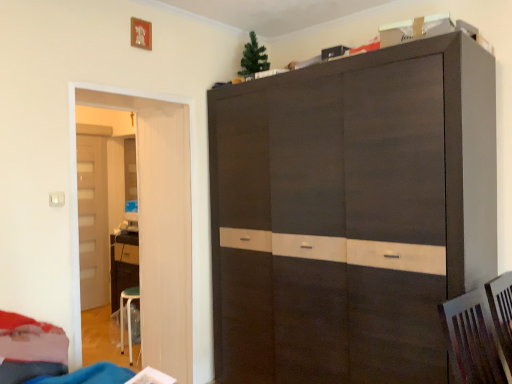
What is the approximate width of white glossy door at left, which appears as the first door when viewed from the front?

white glossy door at left, which appears as the first door when viewed from the front, is 2.17 inches wide.

What do you see at coordinates (153, 221) in the screenshot?
I see `white glossy door at left, which is the 2th door in left-to-right order` at bounding box center [153, 221].

What do you see at coordinates (93, 220) in the screenshot?
I see `light brown wood door at left, positioned as the first door in left-to-right order` at bounding box center [93, 220].

Describe the element at coordinates (30, 349) in the screenshot. I see `velvet red bed at lower left` at that location.

I want to click on white glossy door at left, positioned as the second door in back-to-front order, so pos(153,221).

How different are the orientations of velvet red bed at lower left and light brown wood door at left, the 2th door in the front-to-back sequence, in degrees?

They differ by 1.92 degrees in their facing directions.

Is velvet red bed at lower left not inside light brown wood door at left, positioned as the first door in left-to-right order?

Yes, velvet red bed at lower left is not within light brown wood door at left, positioned as the first door in left-to-right order.

Is velvet red bed at lower left next to light brown wood door at left, which is the second door from right to left, and touching it?

No, velvet red bed at lower left is not in contact with light brown wood door at left, which is the second door from right to left.

Is velvet red bed at lower left positioned with its back to light brown wood door at left, the 2th door in the front-to-back sequence?

velvet red bed at lower left does not have its back to light brown wood door at left, the 2th door in the front-to-back sequence.

Looking at their sizes, would you say velvet red bed at lower left is wider or thinner than white glossy door at left, which is the 2th door in left-to-right order?

Considering their sizes, velvet red bed at lower left looks broader than white glossy door at left, which is the 2th door in left-to-right order.

Would you say velvet red bed at lower left is to the left or to the right of white glossy door at left, the first door in the right-to-left sequence, in the picture?

velvet red bed at lower left is to the left of white glossy door at left, the first door in the right-to-left sequence.

Is velvet red bed at lower left aimed at white glossy door at left, which appears as the first door when viewed from the front?

No, velvet red bed at lower left is not turned towards white glossy door at left, which appears as the first door when viewed from the front.

Based on the photo, could white glossy door at left, the first door in the right-to-left sequence, be considered to be inside light brown wood door at left, which is the second door from right to left?

Definitely not — white glossy door at left, the first door in the right-to-left sequence, is not inside light brown wood door at left, which is the second door from right to left.

Is light brown wood door at left, which is the second door from right to left, taller or shorter than white glossy door at left, the first door in the right-to-left sequence?

light brown wood door at left, which is the second door from right to left, is taller than white glossy door at left, the first door in the right-to-left sequence.

Can you confirm if light brown wood door at left, which is the second door from right to left, is positioned to the right of white glossy door at left, positioned as the second door in back-to-front order?

In fact, light brown wood door at left, which is the second door from right to left, is to the left of white glossy door at left, positioned as the second door in back-to-front order.

Could you tell me if white glossy door at left, positioned as the second door in back-to-front order, is facing velvet red bed at lower left?

No, white glossy door at left, positioned as the second door in back-to-front order, does not turn towards velvet red bed at lower left.

Who is more distant, white glossy door at left, which appears as the first door when viewed from the front, or velvet red bed at lower left?

white glossy door at left, which appears as the first door when viewed from the front.

From the picture: Between white glossy door at left, the first door in the right-to-left sequence, and velvet red bed at lower left, which one appears on the left side from the viewer's perspective?

velvet red bed at lower left.

From a real-world perspective, which is physically above, white glossy door at left, the first door in the right-to-left sequence, or velvet red bed at lower left?

white glossy door at left, the first door in the right-to-left sequence.

From the image's perspective, would you say white glossy door at left, the first door in the right-to-left sequence, is positioned over light brown wood door at left, which ranks as the 1th door in back-to-front order?

Yes, from the image's perspective, white glossy door at left, the first door in the right-to-left sequence, is above light brown wood door at left, which ranks as the 1th door in back-to-front order.

Between white glossy door at left, the first door in the right-to-left sequence, and light brown wood door at left, the 2th door in the front-to-back sequence, which one appears on the left side from the viewer's perspective?

From the viewer's perspective, light brown wood door at left, the 2th door in the front-to-back sequence, appears more on the left side.

Is white glossy door at left, which is the 2th door in left-to-right order, situated inside light brown wood door at left, positioned as the first door in left-to-right order, or outside?

white glossy door at left, which is the 2th door in left-to-right order, is outside light brown wood door at left, positioned as the first door in left-to-right order.

Are white glossy door at left, the first door in the right-to-left sequence, and light brown wood door at left, which is the second door from right to left, making contact?

No, white glossy door at left, the first door in the right-to-left sequence, is not in contact with light brown wood door at left, which is the second door from right to left.

Is point (92, 241) closer or farther from the camera than point (16, 339)?

Clearly, point (92, 241) is more distant from the camera than point (16, 339).

Does light brown wood door at left, the 2th door in the front-to-back sequence, touch velvet red bed at lower left?

No, light brown wood door at left, the 2th door in the front-to-back sequence, is not in contact with velvet red bed at lower left.

Is light brown wood door at left, which is the second door from right to left, outside of velvet red bed at lower left?

Absolutely, light brown wood door at left, which is the second door from right to left, is external to velvet red bed at lower left.

Identify the location of bed on the right of light brown wood door at left, which is the second door from right to left. The width and height of the screenshot is (512, 384). (30, 349).

Locate an element on the screen. bed in front of the white glossy door at left, which appears as the first door when viewed from the front is located at coordinates (30, 349).

Looking at the image, which one is located closer to velvet red bed at lower left, white glossy door at left, positioned as the second door in back-to-front order, or light brown wood door at left, positioned as the first door in left-to-right order?

The object closer to velvet red bed at lower left is white glossy door at left, positioned as the second door in back-to-front order.

Estimate the real-world distances between objects in this image. Which object is further from velvet red bed at lower left, light brown wood door at left, positioned as the first door in left-to-right order, or white glossy door at left, which is the 2th door in left-to-right order?

light brown wood door at left, positioned as the first door in left-to-right order, is further to velvet red bed at lower left.

Which object lies further to the anchor point white glossy door at left, which is the 2th door in left-to-right order, velvet red bed at lower left or light brown wood door at left, the 2th door in the front-to-back sequence?

light brown wood door at left, the 2th door in the front-to-back sequence.

Looking at the image, which one is located further to light brown wood door at left, which ranks as the 1th door in back-to-front order, velvet red bed at lower left or white glossy door at left, the first door in the right-to-left sequence?

Among the two, velvet red bed at lower left is located further to light brown wood door at left, which ranks as the 1th door in back-to-front order.

Based on their spatial positions, is white glossy door at left, which is the 2th door in left-to-right order, or velvet red bed at lower left further from light brown wood door at left, which is the second door from right to left?

Among the two, velvet red bed at lower left is located further to light brown wood door at left, which is the second door from right to left.

Consider the image. Based on their spatial positions, is light brown wood door at left, which ranks as the 1th door in back-to-front order, or velvet red bed at lower left closer to white glossy door at left, the first door in the right-to-left sequence?

Based on the image, velvet red bed at lower left appears to be nearer to white glossy door at left, the first door in the right-to-left sequence.

Locate an element on the screen. door between velvet red bed at lower left and light brown wood door at left, which is the second door from right to left, in the front-back direction is located at coordinates tap(153, 221).